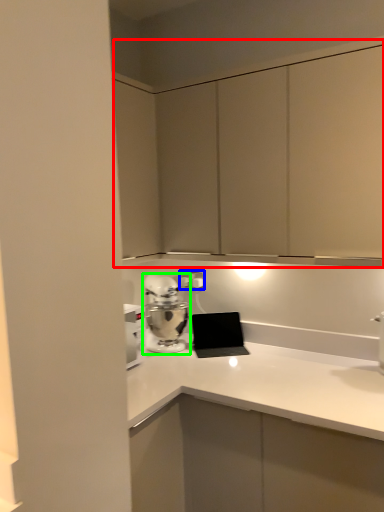
Question: Based on their relative distances, which object is nearer to dresser (highlighted by a red box)? Choose from electric outlet (highlighted by a blue box) and home appliance (highlighted by a green box).

Choices:
 (A) electric outlet
 (B) home appliance

Answer: (B)